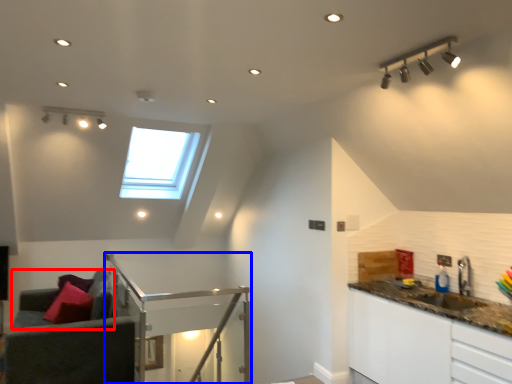
Question: Which object is further to the camera taking this photo, couch (highlighted by a red box) or balustrade (highlighted by a blue box)?

Choices:
 (A) couch
 (B) balustrade

Answer: (A)